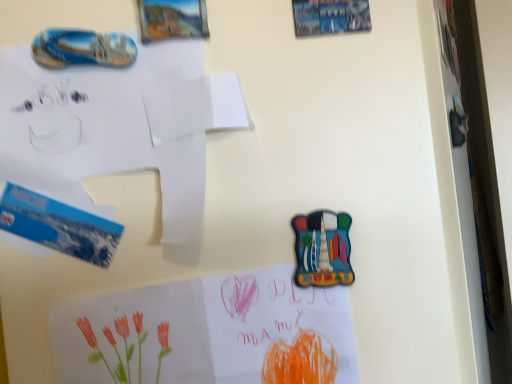
Question: Looking at the image, does white paper at upper left, placed as the 1th paper when sorted from top to bottom, seem bigger or smaller compared to watercolor paper at lower center, which ranks as the second paper in top-to-bottom order?

Choices:
 (A) big
 (B) small

Answer: (A)

Question: From their relative heights in the image, would you say white paper at upper left, which appears as the 2th paper when ordered from the bottom, is taller or shorter than watercolor paper at lower center, which ranks as the second paper in top-to-bottom order?

Choices:
 (A) short
 (B) tall

Answer: (A)

Question: Do you think white paper at upper left, placed as the 1th paper when sorted from top to bottom, is within watercolor paper at lower center, which ranks as the second paper in top-to-bottom order, or outside of it?

Choices:
 (A) outside
 (B) inside

Answer: (A)

Question: Considering their positions, is watercolor paper at lower center, the 1th paper when ordered from bottom to top, located in front of or behind white paper at upper left, which appears as the 2th paper when ordered from the bottom?

Choices:
 (A) behind
 (B) front

Answer: (A)

Question: In terms of width, does watercolor paper at lower center, which ranks as the second paper in top-to-bottom order, look wider or thinner when compared to white paper at upper left, placed as the 1th paper when sorted from top to bottom?

Choices:
 (A) thin
 (B) wide

Answer: (A)

Question: Would you say watercolor paper at lower center, which ranks as the second paper in top-to-bottom order, is to the left or to the right of white paper at upper left, which appears as the 2th paper when ordered from the bottom, in the picture?

Choices:
 (A) right
 (B) left

Answer: (A)

Question: Based on their sizes in the image, would you say watercolor paper at lower center, the 1th paper when ordered from bottom to top, is bigger or smaller than white paper at upper left, placed as the 1th paper when sorted from top to bottom?

Choices:
 (A) big
 (B) small

Answer: (B)